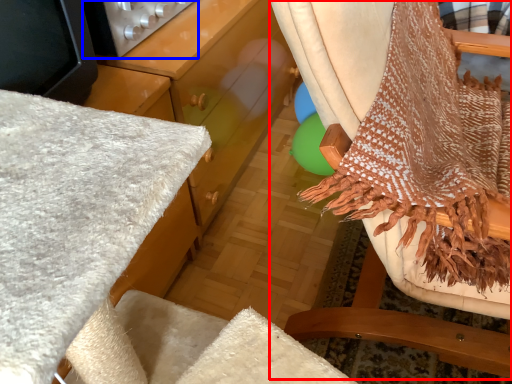
Question: Which object appears farthest to the camera in this image, chair (highlighted by a red box) or appliance (highlighted by a blue box)?

Choices:
 (A) chair
 (B) appliance

Answer: (B)